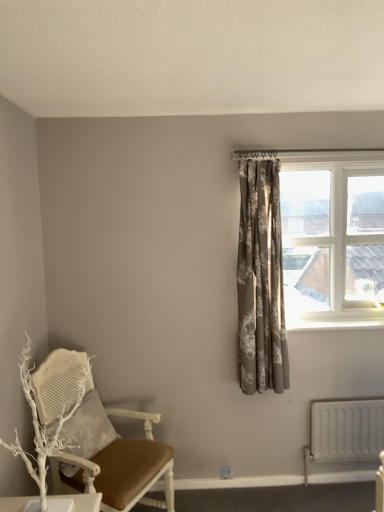
Question: Can white textured pillow at lower left be found inside white painted wood at upper right?

Choices:
 (A) no
 (B) yes

Answer: (A)

Question: Is white painted wood at upper right looking in the opposite direction of white textured pillow at lower left?

Choices:
 (A) no
 (B) yes

Answer: (A)

Question: From the image's perspective, does white painted wood at upper right appear higher than white textured pillow at lower left?

Choices:
 (A) yes
 (B) no

Answer: (A)

Question: Is white painted wood at upper right positioned before white textured pillow at lower left?

Choices:
 (A) no
 (B) yes

Answer: (A)

Question: Is white painted wood at upper right taller than white textured pillow at lower left?

Choices:
 (A) no
 (B) yes

Answer: (A)

Question: From the image's perspective, is white painted wood at upper right located beneath white textured pillow at lower left?

Choices:
 (A) yes
 (B) no

Answer: (B)

Question: Would you consider white matte radiator at lower right to be distant from white painted wood chair at left?

Choices:
 (A) no
 (B) yes

Answer: (B)

Question: From a real-world perspective, is white matte radiator at lower right located beneath white painted wood chair at left?

Choices:
 (A) yes
 (B) no

Answer: (A)

Question: Is white matte radiator at lower right at the left side of white painted wood chair at left?

Choices:
 (A) no
 (B) yes

Answer: (A)

Question: Is white matte radiator at lower right closer to camera compared to white painted wood chair at left?

Choices:
 (A) yes
 (B) no

Answer: (B)

Question: Can you confirm if white matte radiator at lower right is shorter than white painted wood chair at left?

Choices:
 (A) yes
 (B) no

Answer: (A)

Question: Is white matte radiator at lower right outside white painted wood chair at left?

Choices:
 (A) no
 (B) yes

Answer: (B)

Question: Could you tell me if white matte radiator at lower right is facing silvery-grey floral curtain at upper right?

Choices:
 (A) no
 (B) yes

Answer: (A)